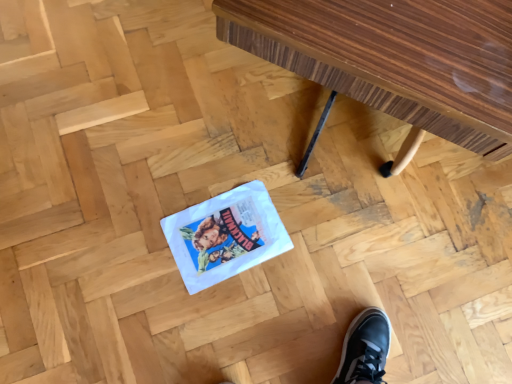
Find the location of a particular element. wooden table at center is located at coordinates (394, 58).

The height and width of the screenshot is (384, 512). Describe the element at coordinates (394, 58) in the screenshot. I see `wooden table at center` at that location.

At what (x,y) coordinates should I click in order to perform the action: click on wooden table at center. Please return your answer as a coordinate pair (x, y). The width and height of the screenshot is (512, 384). Looking at the image, I should click on (394, 58).